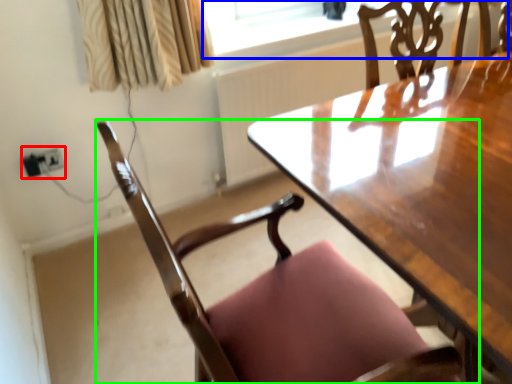
Question: Considering the real-world distances, which object is farthest from electric outlet (highlighted by a red box)? window screen (highlighted by a blue box) or chair (highlighted by a green box)?

Choices:
 (A) window screen
 (B) chair

Answer: (B)